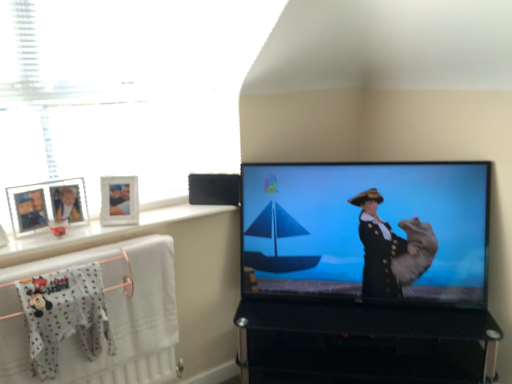
This screenshot has width=512, height=384. Identify the location of free location above white fabric hanger at lower left (from a real-world perspective). (60, 269).